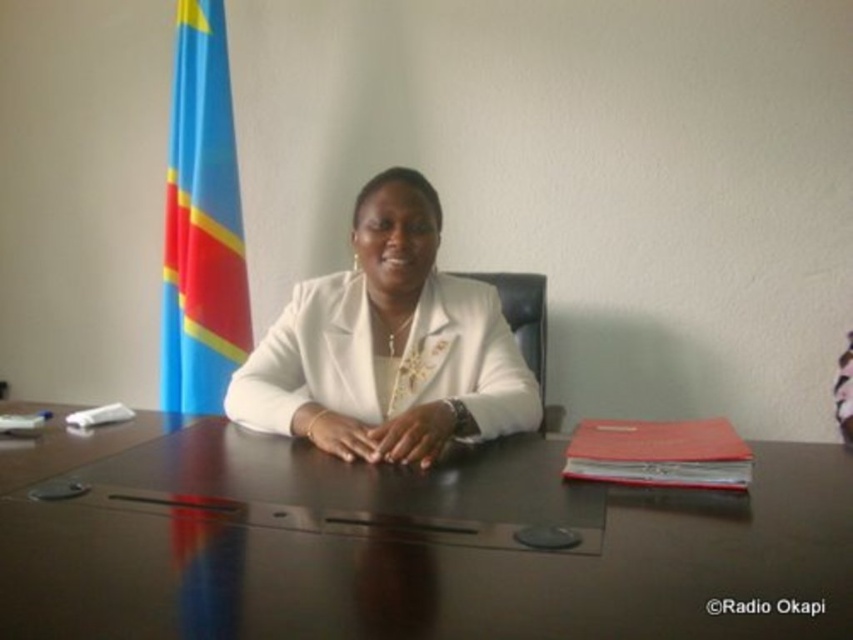
You are standing in the office and want to place a new item exactly at the center of the dark brown polished wood table at center. What coordinates should you aim for?

The dark brown polished wood table at center is positioned at point (405, 544), so you should aim for those coordinates to place the item at its center.

In the scene shown: You are a delivery person who needs to place a 10 inch package between the dark brown polished wood table at center and the white glossy jacket at center. Is there enough space to fit it without overlapping either object?

The distance between the dark brown polished wood table at center and the white glossy jacket at center is 10.78 inches. Since the package is 10 inches long, it can fit in the available space as 10.78 inches is greater than 10 inches.

You are standing in an office and see the dark brown polished wood table at center and the white glossy jacket at center. Which object is positioned to the left?

The dark brown polished wood table at center is to the left of the white glossy jacket at center.